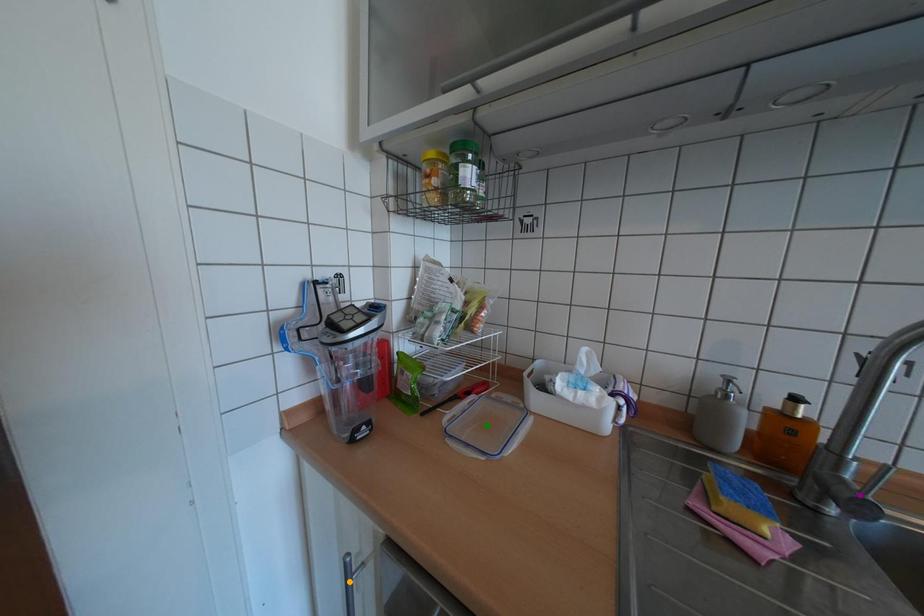
Order these from nearest to farthest:
green point
purple point
orange point

purple point, orange point, green point